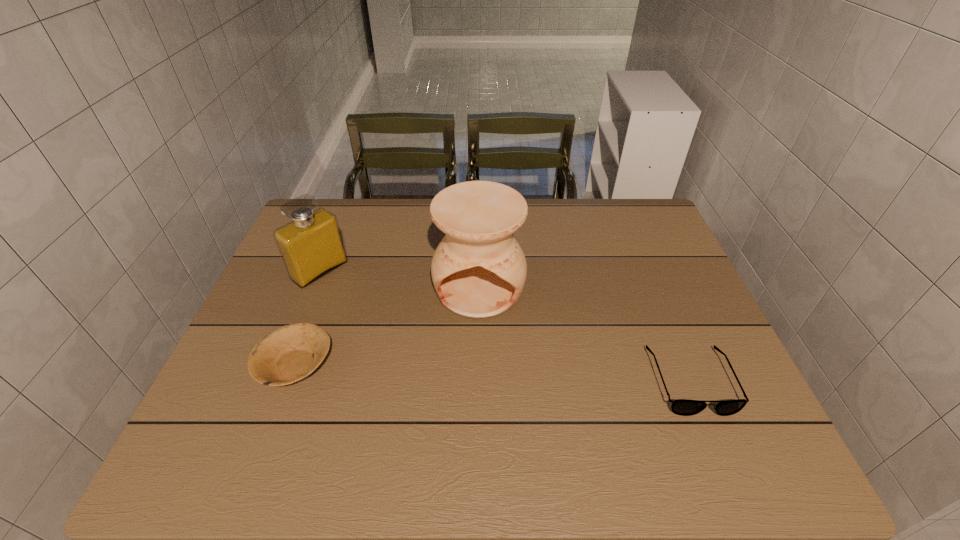
Identify the location of vacant space on the desktop that is between the bowl and the spectacles and is positioned at the open side of the second object from right to left. (476, 373).

Find the location of `vacant space on the desktop that is between the bowl and the rightmost object and is positioned on the front-facing side of the perfume`. vacant space on the desktop that is between the bowl and the rightmost object and is positioned on the front-facing side of the perfume is located at coordinates 453,372.